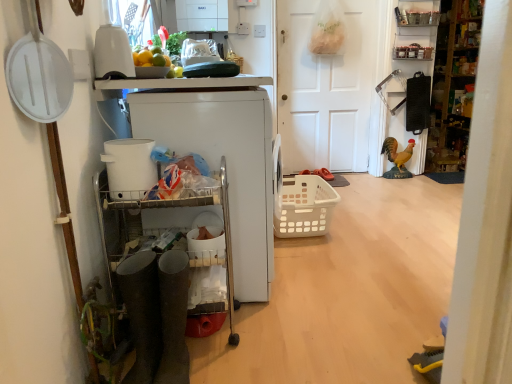
Identify the location of empty space that is ontop of white plastic bucket at left, positioned as the 1th appliance in front-to-back order (from a real-world perspective). This screenshot has height=384, width=512. (129, 149).